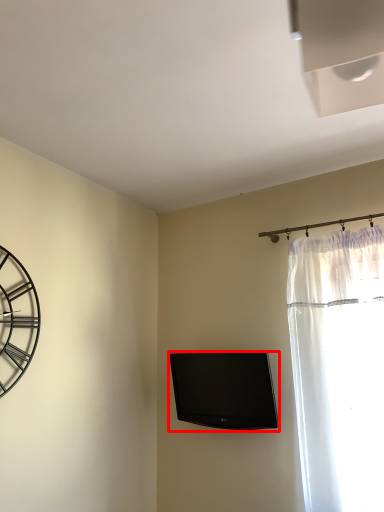
Question: From the image's perspective, where is television (annotated by the red box) located relative to wall clock?

Choices:
 (A) above
 (B) below

Answer: (B)